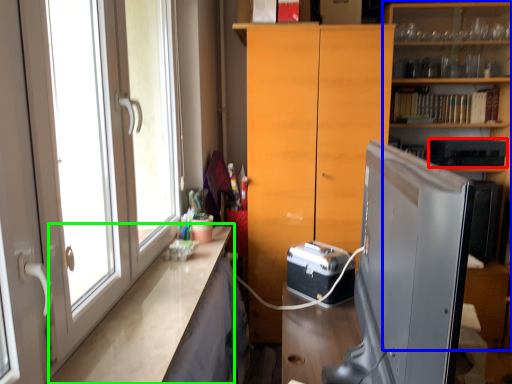
Question: Which object is the closest to the appliance (highlighted by a red box)? Choose among these: shelf (highlighted by a blue box) or counter top (highlighted by a green box).

Choices:
 (A) shelf
 (B) counter top

Answer: (A)